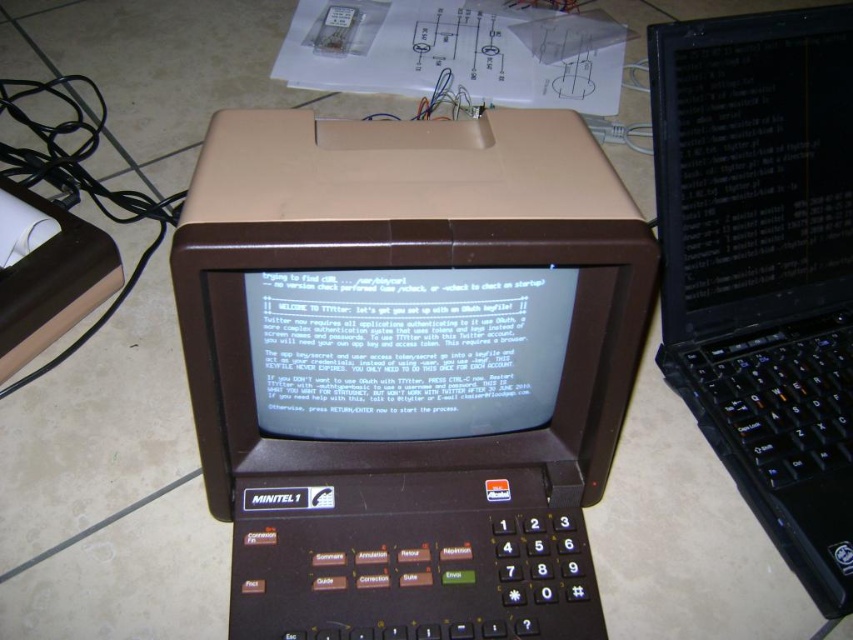
Which is more to the left, brown plastic minitel 1 at center or black glossy laptop at upper right?

brown plastic minitel 1 at center

Can you confirm if brown plastic minitel 1 at center is taller than black glossy laptop at upper right?

No, brown plastic minitel 1 at center is not taller than black glossy laptop at upper right.

I want to click on brown plastic minitel 1 at center, so click(x=408, y=368).

The image size is (853, 640). Identify the location of brown plastic minitel 1 at center. (408, 368).